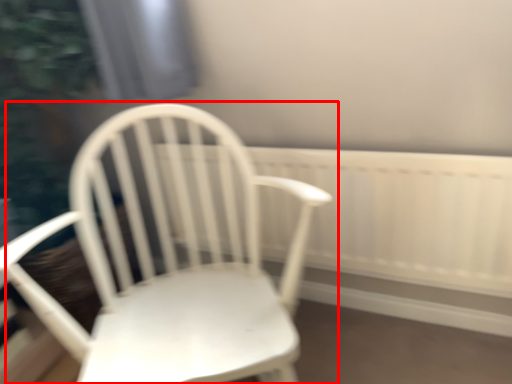
Question: From the image's perspective, where is chair (annotated by the red box) located in relation to radiator in the image?

Choices:
 (A) above
 (B) below

Answer: (B)